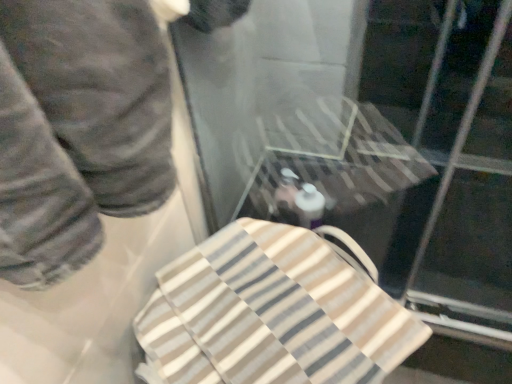
Question: Which direction should I rotate to look at transparent plastic glass door at upper center?

Choices:
 (A) right
 (B) left

Answer: (A)

Question: From the image's perspective, is transparent plastic glass door at upper center located above dark gray pants at left?

Choices:
 (A) yes
 (B) no

Answer: (B)

Question: Can you confirm if transparent plastic glass door at upper center is positioned to the right of dark gray pants at left?

Choices:
 (A) yes
 (B) no

Answer: (A)

Question: From the image's perspective, does transparent plastic glass door at upper center appear lower than dark gray pants at left?

Choices:
 (A) no
 (B) yes

Answer: (B)

Question: Does transparent plastic glass door at upper center have a lesser width compared to dark gray pants at left?

Choices:
 (A) no
 (B) yes

Answer: (A)

Question: Is transparent plastic glass door at upper center far from dark gray pants at left?

Choices:
 (A) no
 (B) yes

Answer: (A)

Question: Does transparent plastic glass door at upper center have a greater width compared to dark gray pants at left?

Choices:
 (A) no
 (B) yes

Answer: (B)

Question: Can you confirm if beige striped towel at center is bigger than transparent plastic glass door at upper center?

Choices:
 (A) yes
 (B) no

Answer: (B)

Question: Is beige striped towel at center further to the viewer compared to transparent plastic glass door at upper center?

Choices:
 (A) no
 (B) yes

Answer: (A)

Question: Is beige striped towel at center in front of transparent plastic glass door at upper center?

Choices:
 (A) no
 (B) yes

Answer: (B)

Question: From the image's perspective, would you say beige striped towel at center is shown under transparent plastic glass door at upper center?

Choices:
 (A) yes
 (B) no

Answer: (A)

Question: Can you confirm if beige striped towel at center is smaller than transparent plastic glass door at upper center?

Choices:
 (A) no
 (B) yes

Answer: (B)

Question: Is transparent plastic glass door at upper center located within beige striped towel at center?

Choices:
 (A) yes
 (B) no

Answer: (B)

Question: Is beige striped towel at center surrounded by dark gray pants at left?

Choices:
 (A) no
 (B) yes

Answer: (A)